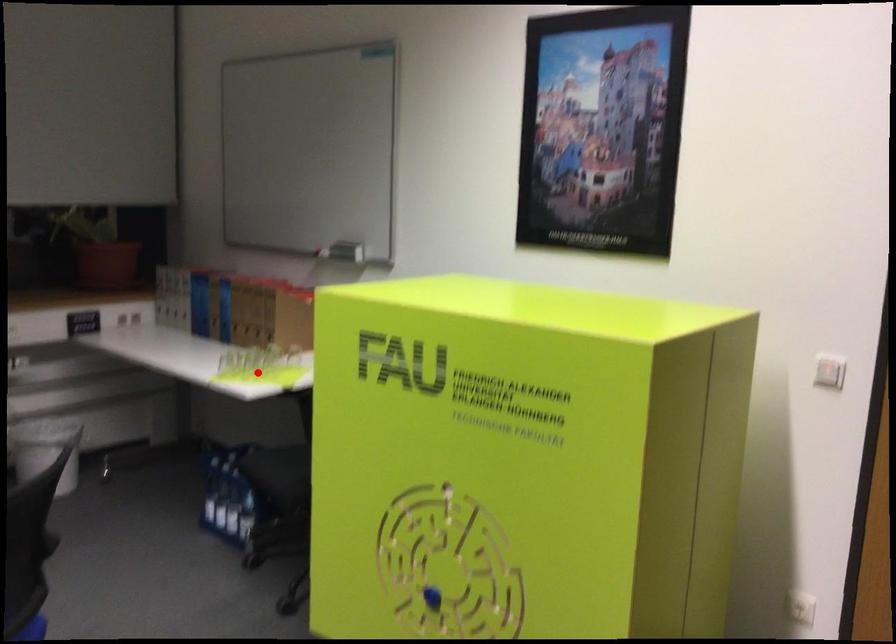
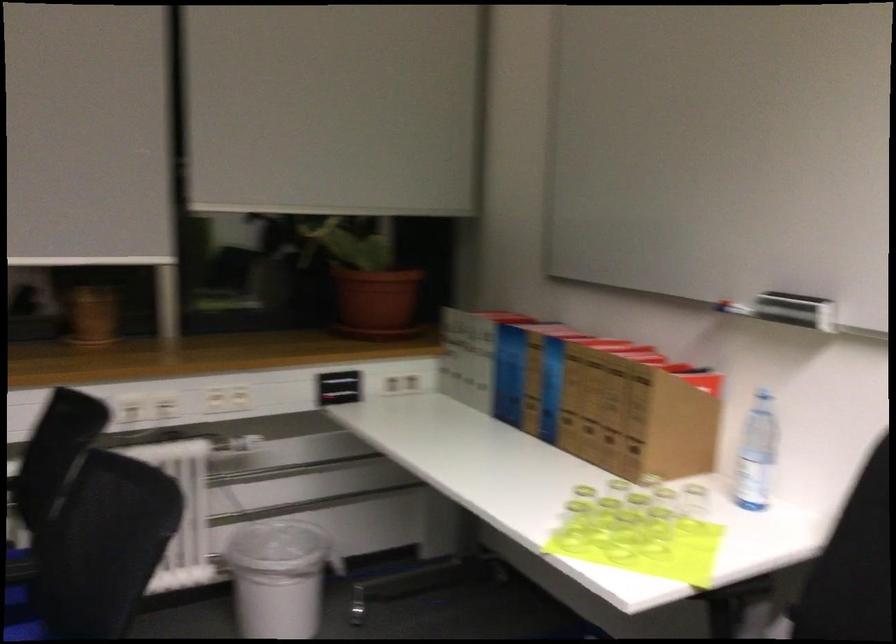
Question: I am providing you with two images of the same scene from different viewpoints. In image1, a red point is highlighted. Considering the same 3D point in image2, which of the following is correct?

Choices:
 (A) It is closer
 (B) It is farther

Answer: (A)